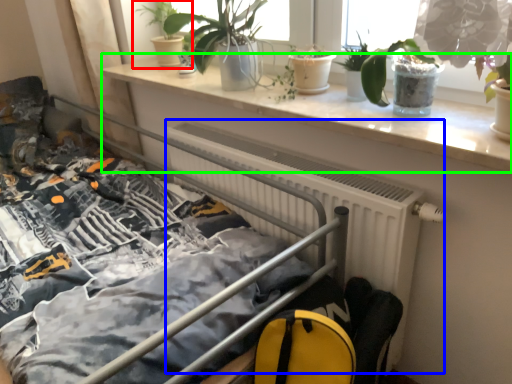
Question: Considering the real-world distances, which object is farthest from houseplant (highlighted by a red box)? radiator (highlighted by a blue box) or window sill (highlighted by a green box)?

Choices:
 (A) radiator
 (B) window sill

Answer: (A)